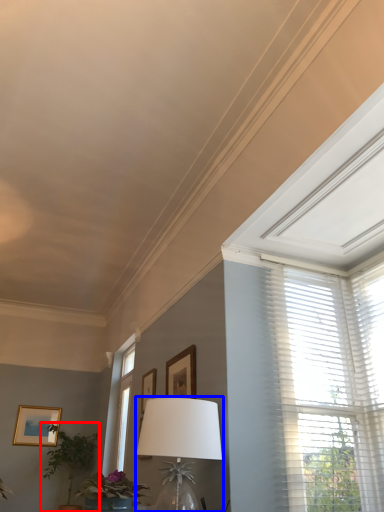
Question: Which point is further to the camera, houseplant (highlighted by a red box) or table lamp (highlighted by a blue box)?

Choices:
 (A) houseplant
 (B) table lamp

Answer: (A)